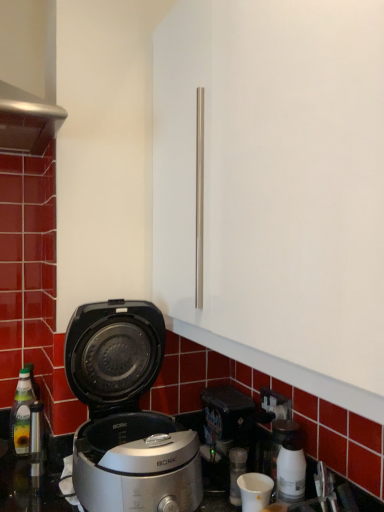
Question: In terms of width, does white glossy coffee machine at lower right look wider or thinner when compared to translucent glass bottle at left?

Choices:
 (A) thin
 (B) wide

Answer: (A)

Question: Considering the positions of white glossy coffee machine at lower right and translucent glass bottle at left in the image, is white glossy coffee machine at lower right taller or shorter than translucent glass bottle at left?

Choices:
 (A) tall
 (B) short

Answer: (B)

Question: Which is nearer to the translucent glass bottle at left?

Choices:
 (A) white matte cup at lower center
 (B) metallic silver countertop at lower center
 (C) white glossy coffee machine at lower right
 (D) silver metallic rice cooker at lower left
 (E) black plastic electric outlet at lower right

Answer: (B)

Question: Considering the real-world distances, which object is farthest from the translucent glass bottle at left?

Choices:
 (A) white matte cup at lower center
 (B) white glossy coffee machine at lower right
 (C) metallic silver countertop at lower center
 (D) silver metallic rice cooker at lower left
 (E) black plastic electric outlet at lower right

Answer: (B)